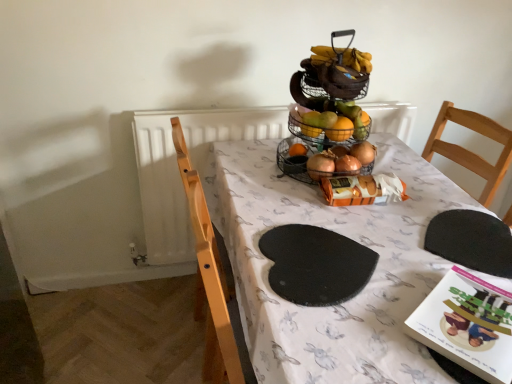
Locate an element on the screen. white fabric table at center is located at coordinates (344, 235).

What do you see at coordinates (471, 241) in the screenshot? I see `black rubber placemat at lower right, positioned as the 2th mat in left-to-right order` at bounding box center [471, 241].

Where is `black felt mat at center, which ranks as the first mat in left-to-right order`? black felt mat at center, which ranks as the first mat in left-to-right order is located at coordinates (316, 264).

From a real-world perspective, which is physically above, white fabric table at center or white paper book at lower right?

white paper book at lower right, from a real-world perspective.

Is point (349, 337) farther from camera compared to point (445, 340)?

Yes, point (349, 337) is behind point (445, 340).

Considering the sizes of white fabric table at center and white paper book at lower right in the image, is white fabric table at center wider or thinner than white paper book at lower right?

white fabric table at center is wider than white paper book at lower right.

Considering the relative positions of white fabric table at center and white paper book at lower right in the image provided, is white fabric table at center to the left of white paper book at lower right from the viewer's perspective?

Indeed, white fabric table at center is positioned on the left side of white paper book at lower right.

Considering the sizes of objects white fabric table at center and wire mesh basket at center in the image provided, who is bigger, white fabric table at center or wire mesh basket at center?

white fabric table at center is bigger.

Considering the relative sizes of white fabric table at center and wire mesh basket at center in the image provided, is white fabric table at center taller than wire mesh basket at center?

Correct, white fabric table at center is much taller as wire mesh basket at center.

How different are the orientations of white fabric table at center and wire mesh basket at center in degrees?

There is a 1.63-degree angle between the facing directions of white fabric table at center and wire mesh basket at center.

Is wire mesh basket at center facing towards white paper book at lower right?

Yes.

From the image's perspective, between wire mesh basket at center and white paper book at lower right, which one is located above?

wire mesh basket at center, from the image's perspective.

Is wire mesh basket at center taller or shorter than white paper book at lower right?

In the image, wire mesh basket at center appears to be taller than white paper book at lower right.

Is the depth of wire mesh basket at center greater than that of white paper book at lower right?

Yes, the depth of wire mesh basket at center is greater than that of white paper book at lower right.

Is black felt mat at center, which ranks as the first mat in left-to-right order, at the back of black rubber placemat at lower right, positioned as the 2th mat in left-to-right order?

No, black rubber placemat at lower right, positioned as the 2th mat in left-to-right order, is not facing away from black felt mat at center, which ranks as the first mat in left-to-right order.

Measure the distance between black rubber placemat at lower right, positioned as the 2th mat in left-to-right order, and black felt mat at center, which ranks as the second mat in right-to-left order.

black rubber placemat at lower right, positioned as the 2th mat in left-to-right order, is 29.36 centimeters from black felt mat at center, which ranks as the second mat in right-to-left order.

From a real-world perspective, which is physically below, black rubber placemat at lower right, positioned as the 2th mat in left-to-right order, or black felt mat at center, which ranks as the first mat in left-to-right order?

In real-world perspective, black rubber placemat at lower right, positioned as the 2th mat in left-to-right order, is lower.

From the image's perspective, relative to black felt mat at center, which ranks as the second mat in right-to-left order, is black rubber placemat at lower right, which is counted as the first mat, starting from the right, above or below?

From the image's perspective, black rubber placemat at lower right, which is counted as the first mat, starting from the right, appears above black felt mat at center, which ranks as the second mat in right-to-left order.

Considering the relative sizes of black felt mat at center, which ranks as the first mat in left-to-right order, and wire mesh basket at center in the image provided, is black felt mat at center, which ranks as the first mat in left-to-right order, bigger than wire mesh basket at center?

No, black felt mat at center, which ranks as the first mat in left-to-right order, is not bigger than wire mesh basket at center.

Is black felt mat at center, which ranks as the first mat in left-to-right order, completely or partially outside of wire mesh basket at center?

Yes, black felt mat at center, which ranks as the first mat in left-to-right order, is not within wire mesh basket at center.

Looking at this image, in terms of width, does black felt mat at center, which ranks as the second mat in right-to-left order, look wider or thinner when compared to wire mesh basket at center?

Clearly, black felt mat at center, which ranks as the second mat in right-to-left order, has more width compared to wire mesh basket at center.

Is wire mesh basket at center shorter than white fabric table at center?

Indeed, wire mesh basket at center has a lesser height compared to white fabric table at center.

Does wire mesh basket at center contain white fabric table at center?

Definitely not — white fabric table at center is not inside wire mesh basket at center.

Is point (319, 171) positioned after point (432, 258)?

Yes, it is.

Is wire mesh basket at center in front of or behind white fabric table at center in the image?

In the image, wire mesh basket at center appears behind white fabric table at center.

Consider the image. Is the depth of black felt mat at center, which ranks as the second mat in right-to-left order, less than that of white fabric table at center?

No, the depth of black felt mat at center, which ranks as the second mat in right-to-left order, is greater than that of white fabric table at center.

Looking at this image, can you confirm if black felt mat at center, which ranks as the second mat in right-to-left order, is wider than white fabric table at center?

No.

Could you tell me if black felt mat at center, which ranks as the first mat in left-to-right order, is facing white fabric table at center?

Yes, black felt mat at center, which ranks as the first mat in left-to-right order, is turned towards white fabric table at center.

Is black felt mat at center, which ranks as the second mat in right-to-left order, placed right next to white fabric table at center?

No, black felt mat at center, which ranks as the second mat in right-to-left order, is not making contact with white fabric table at center.

Locate an element on the screen. table that is on the left side of white paper book at lower right is located at coordinates 344,235.

Identify the location of table to the right of wire mesh basket at center. The height and width of the screenshot is (384, 512). (344, 235).

Considering their positions, is white paper book at lower right positioned further to wire mesh basket at center than black felt mat at center, which ranks as the second mat in right-to-left order?

white paper book at lower right.

Looking at the image, which one is located closer to black felt mat at center, which ranks as the second mat in right-to-left order, white fabric table at center or white paper book at lower right?

white fabric table at center is closer to black felt mat at center, which ranks as the second mat in right-to-left order.

Which object lies further to the anchor point black rubber placemat at lower right, positioned as the 2th mat in left-to-right order, wire mesh basket at center or white fabric table at center?

wire mesh basket at center.

Estimate the real-world distances between objects in this image. Which object is further from white fabric table at center, wire mesh basket at center or white paper book at lower right?

white paper book at lower right lies further to white fabric table at center than the other object.

Based on their spatial positions, is wire mesh basket at center or black rubber placemat at lower right, positioned as the 2th mat in left-to-right order, closer to white paper book at lower right?

black rubber placemat at lower right, positioned as the 2th mat in left-to-right order, is positioned closer to the anchor white paper book at lower right.

Which object lies nearer to the anchor point black rubber placemat at lower right, which is counted as the first mat, starting from the right, white fabric table at center or black felt mat at center, which ranks as the second mat in right-to-left order?

Based on the image, white fabric table at center appears to be nearer to black rubber placemat at lower right, which is counted as the first mat, starting from the right.

In the scene shown: When comparing their distances from black rubber placemat at lower right, positioned as the 2th mat in left-to-right order, does wire mesh basket at center or white paper book at lower right seem closer?

white paper book at lower right.

When comparing their distances from white fabric table at center, does black rubber placemat at lower right, positioned as the 2th mat in left-to-right order, or wire mesh basket at center seem closer?

wire mesh basket at center lies closer to white fabric table at center than the other object.

Find the location of a particular element. This screenshot has height=384, width=512. table located between black felt mat at center, which ranks as the first mat in left-to-right order, and black rubber placemat at lower right, positioned as the 2th mat in left-to-right order, in the left-right direction is located at coordinates (344, 235).

The image size is (512, 384). Identify the location of book positioned between white fabric table at center and wire mesh basket at center from near to far. (467, 324).

Locate an element on the screen. table between black felt mat at center, which ranks as the first mat in left-to-right order, and white paper book at lower right from left to right is located at coordinates (344, 235).

Locate an element on the screen. book between white fabric table at center and black rubber placemat at lower right, positioned as the 2th mat in left-to-right order, in the front-back direction is located at coordinates (467, 324).